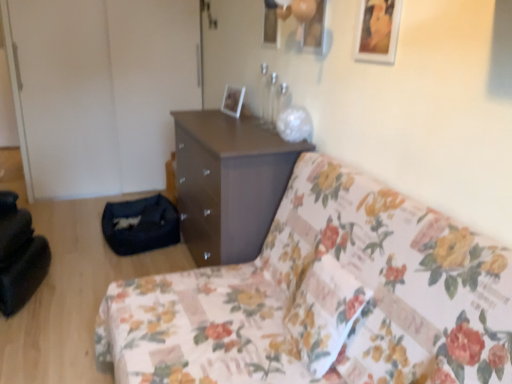
Question: Is matte brown chest of drawers at center located outside white glossy picture frame at upper center, positioned as the first picture frame in back-to-front order?

Choices:
 (A) yes
 (B) no

Answer: (A)

Question: Considering the relative sizes of matte brown chest of drawers at center and white glossy picture frame at upper center, acting as the 2th picture frame starting from the front, in the image provided, is matte brown chest of drawers at center thinner than white glossy picture frame at upper center, acting as the 2th picture frame starting from the front,?

Choices:
 (A) yes
 (B) no

Answer: (B)

Question: Does matte brown chest of drawers at center appear on the right side of white glossy picture frame at upper center, marked as the 2th picture frame in a right-to-left arrangement?

Choices:
 (A) no
 (B) yes

Answer: (A)

Question: Is the depth of matte brown chest of drawers at center less than that of white glossy picture frame at upper center, positioned as the first picture frame in back-to-front order?

Choices:
 (A) yes
 (B) no

Answer: (A)

Question: Is matte brown chest of drawers at center taller than white glossy picture frame at upper center, marked as the 2th picture frame in a right-to-left arrangement?

Choices:
 (A) yes
 (B) no

Answer: (A)

Question: From a real-world perspective, does matte brown chest of drawers at center stand above white glossy picture frame at upper center, marked as the 2th picture frame in a right-to-left arrangement?

Choices:
 (A) no
 (B) yes

Answer: (A)

Question: From a real-world perspective, does white glossy picture frame at upper center, which appears as the first picture frame when viewed from the left, stand above matte brown chest of drawers at center?

Choices:
 (A) no
 (B) yes

Answer: (B)

Question: From the image's perspective, would you say white glossy picture frame at upper center, positioned as the first picture frame in back-to-front order, is positioned over matte brown chest of drawers at center?

Choices:
 (A) no
 (B) yes

Answer: (B)

Question: Considering the relative sizes of white glossy picture frame at upper center, positioned as the first picture frame in back-to-front order, and matte brown chest of drawers at center in the image provided, is white glossy picture frame at upper center, positioned as the first picture frame in back-to-front order, smaller than matte brown chest of drawers at center?

Choices:
 (A) no
 (B) yes

Answer: (B)

Question: Is white glossy picture frame at upper center, marked as the 2th picture frame in a right-to-left arrangement, further to camera compared to matte brown chest of drawers at center?

Choices:
 (A) yes
 (B) no

Answer: (A)

Question: Is white glossy picture frame at upper center, which appears as the first picture frame when viewed from the left, placed right next to matte brown chest of drawers at center?

Choices:
 (A) yes
 (B) no

Answer: (B)

Question: Can matte brown chest of drawers at center be found inside white glossy picture frame at upper center, marked as the 2th picture frame in a right-to-left arrangement?

Choices:
 (A) no
 (B) yes

Answer: (A)

Question: Is floral fabric couch at center bigger than white glossy picture frame at upper center, positioned as the first picture frame in back-to-front order?

Choices:
 (A) yes
 (B) no

Answer: (A)